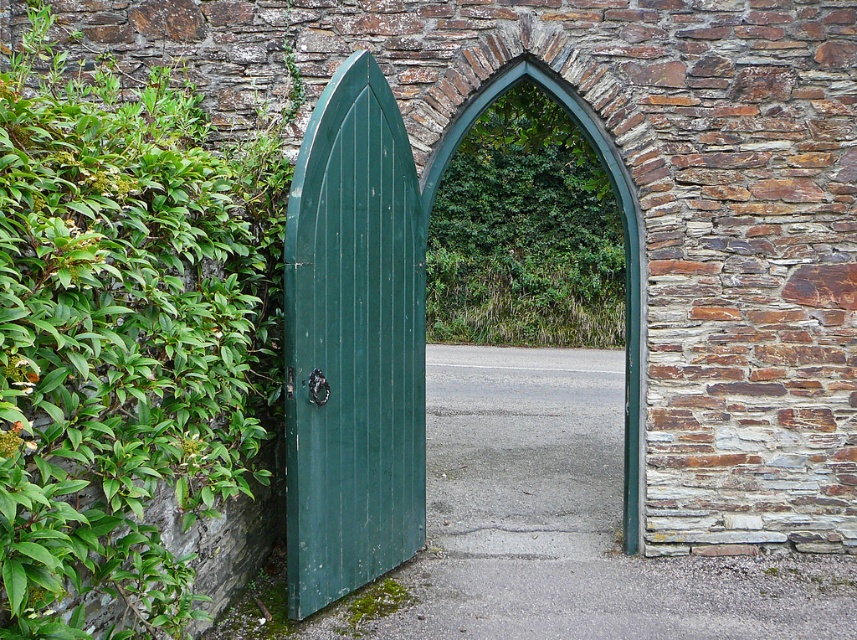
You are standing in front of the arched doorway and want to know which object is narrower between the green wooden door at center and the green leafy vegetation at center. Please answer based on their widths.

The green wooden door at center has a lesser width compared to the green leafy vegetation at center, so the green wooden door at center is narrower.

You are standing in front of the arched doorway and want to enter through the green wooden door at center. However, there is green leafy vegetation at center blocking your path. Which direction should you move to avoid the vegetation and reach the door?

The green wooden door at center is to the left of the green leafy vegetation at center, so you should move to the left to avoid the vegetation and reach the door.